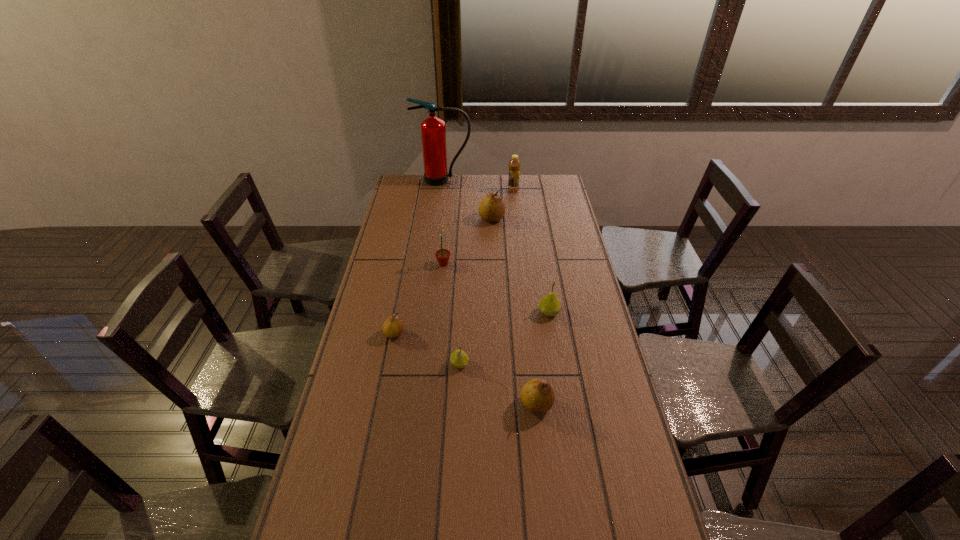
What are the coordinates of `the nearest pear` in the screenshot? It's located at (537, 395).

Find the location of `the second nearest brown pear`. the second nearest brown pear is located at coordinates (393, 327).

This screenshot has width=960, height=540. In order to click on the leftmost brown pear in this screenshot , I will do `click(393, 327)`.

Find the location of a particular element. This screenshot has height=540, width=960. the second pear from left to right is located at coordinates (459, 359).

The width and height of the screenshot is (960, 540). I want to click on the second nearest object, so click(459, 359).

The height and width of the screenshot is (540, 960). Find the location of `vacant space located on the right of the farthest object`. vacant space located on the right of the farthest object is located at coordinates (x=520, y=180).

The height and width of the screenshot is (540, 960). In order to click on blank space located on the left of the bottle in this screenshot , I will do `click(468, 191)`.

You are a GUI agent. You are given a task and a screenshot of the screen. Output one action in this format:
    pyautogui.click(x=<x>, y=<y>)
    Task: Click on the vacant space located 0.090m on the face of the green sunflower
    The height and width of the screenshot is (540, 960).
    Given the screenshot: What is the action you would take?
    pyautogui.click(x=472, y=264)

Identify the location of vacant region located 0.210m on the left of the second brown pear from left to right. (434, 219).

Image resolution: width=960 pixels, height=540 pixels. Find the location of `free region located on the back of the farther green pear`. free region located on the back of the farther green pear is located at coordinates (545, 292).